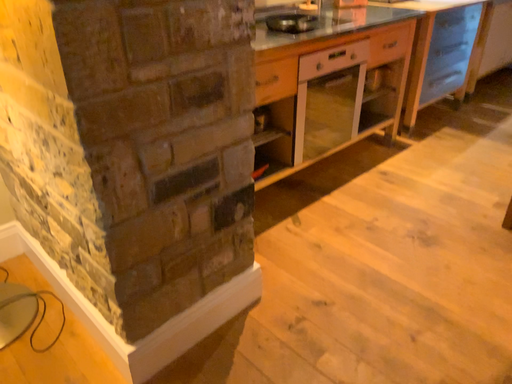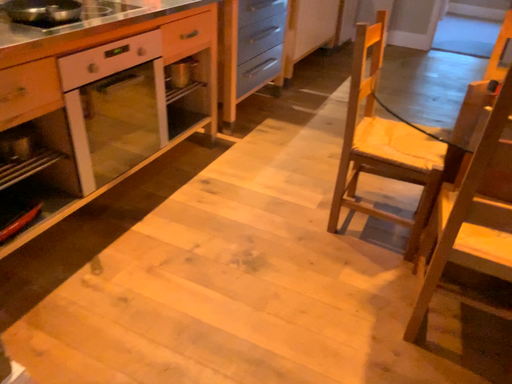
Question: How did the camera likely rotate when shooting the video?

Choices:
 (A) rotated left
 (B) rotated right

Answer: (B)